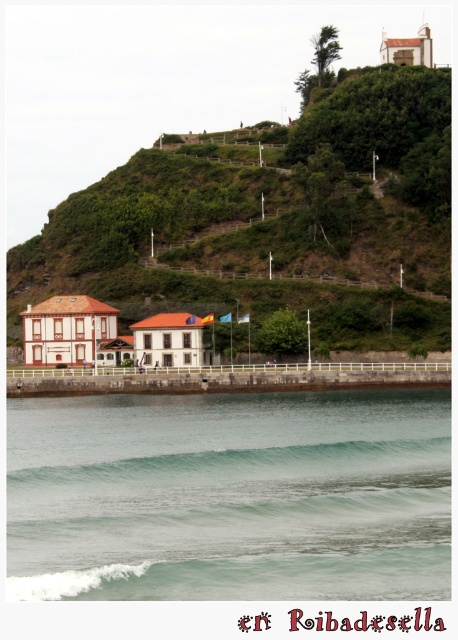
Question: Does clear water at lower center have a larger size compared to green grassy hillside at upper center?

Choices:
 (A) yes
 (B) no

Answer: (B)

Question: Which point is farther from the camera taking this photo?

Choices:
 (A) (141, 289)
 (B) (394, 465)

Answer: (A)

Question: Which object is positioned farthest from the green grassy hillside at upper center?

Choices:
 (A) green translucent wave at lower center
 (B) clear water at lower center

Answer: (A)

Question: Considering the relative positions of clear water at lower center and green translucent wave at lower center in the image provided, where is clear water at lower center located with respect to green translucent wave at lower center?

Choices:
 (A) right
 (B) left

Answer: (B)

Question: Is clear water at lower center smaller than green translucent wave at lower center?

Choices:
 (A) yes
 (B) no

Answer: (B)

Question: Which point is farther to the camera?

Choices:
 (A) (425, 92)
 (B) (75, 593)
 (C) (322, 483)

Answer: (A)